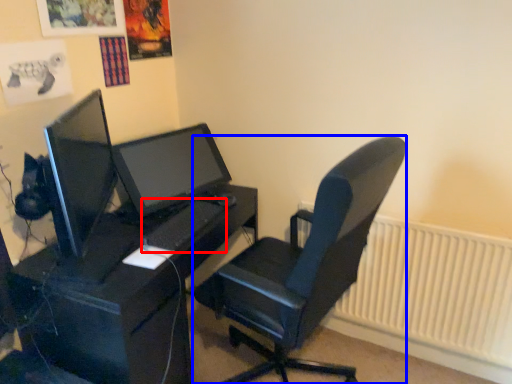
Question: Which object appears closest to the camera in this image, keyboard (highlighted by a red box) or chair (highlighted by a blue box)?

Choices:
 (A) keyboard
 (B) chair

Answer: (B)